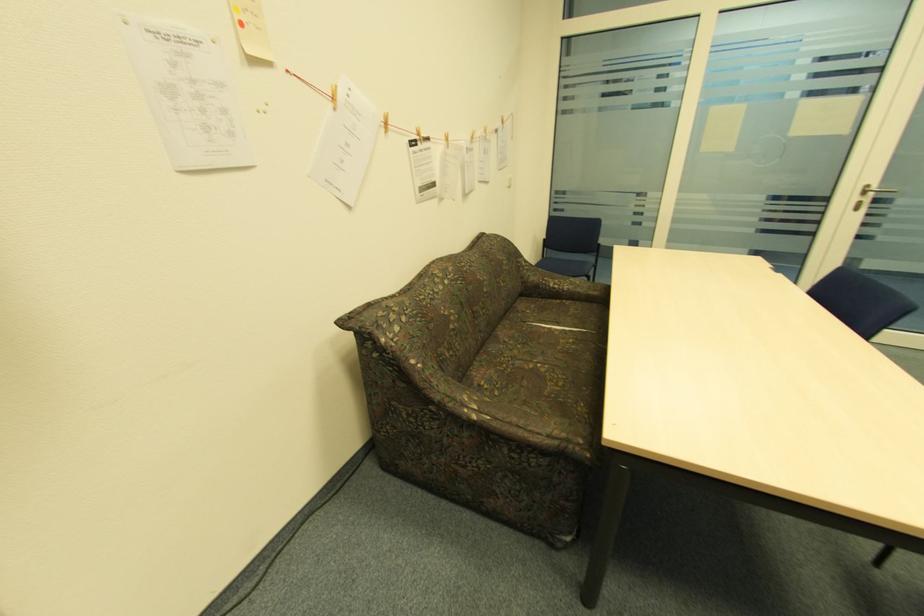
In order to click on patterned sofa armrest in this screenshot , I will do `click(523, 416)`.